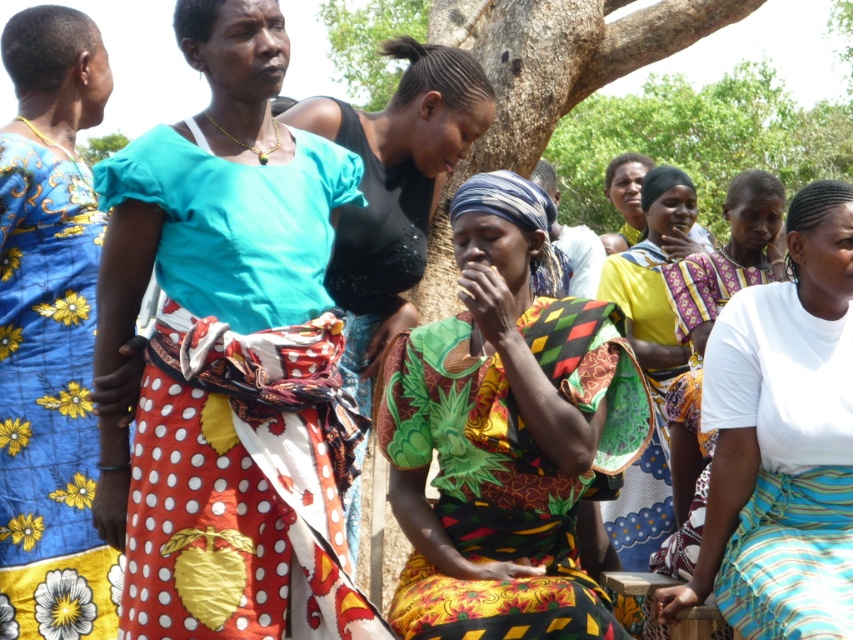
Question: Is the position of matte teal blouse at center more distant than that of matte black top at center?

Choices:
 (A) yes
 (B) no

Answer: (B)

Question: Can you confirm if matte teal blouse at center is thinner than black sequined dress at center?

Choices:
 (A) no
 (B) yes

Answer: (A)

Question: Based on their relative distances, which object is farther from the black sequined dress at center?

Choices:
 (A) brown rough tree trunk at center
 (B) blue floral fabric dress at left

Answer: (A)

Question: Which point is closer to the camera?

Choices:
 (A) printed fabric headscarf at center
 (B) brown rough tree trunk at center

Answer: (A)

Question: Is matte teal blouse at center to the left of black sequined dress at center from the viewer's perspective?

Choices:
 (A) yes
 (B) no

Answer: (A)

Question: Which point is farther to the camera?

Choices:
 (A) brown rough tree trunk at center
 (B) matte teal blouse at center

Answer: (A)